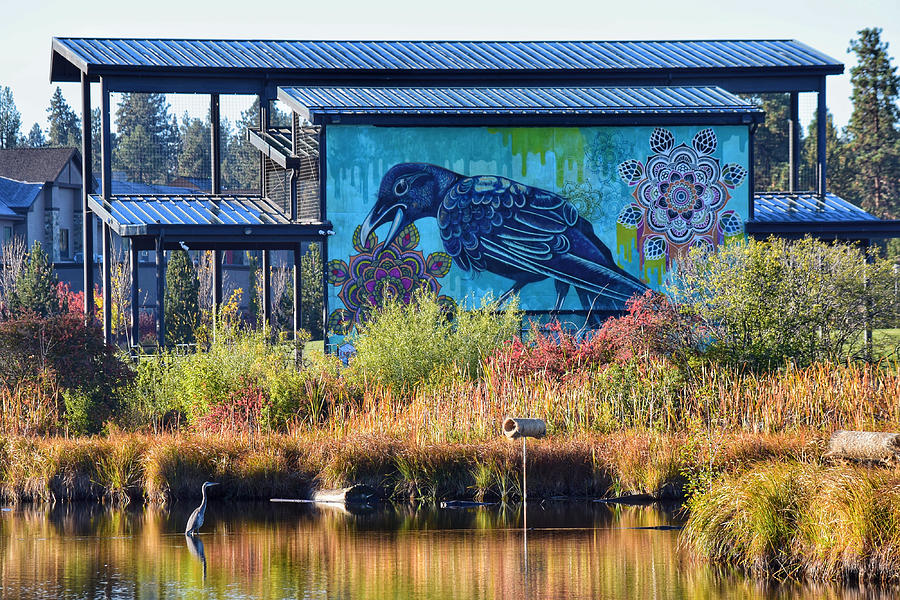
At what (x,y) coordinates should I click in order to perform the action: click on blue mural. Please return your answer as a coordinate pair (x, y). The image size is (900, 600). Looking at the image, I should click on (329, 136), (335, 302), (751, 129), (740, 224).